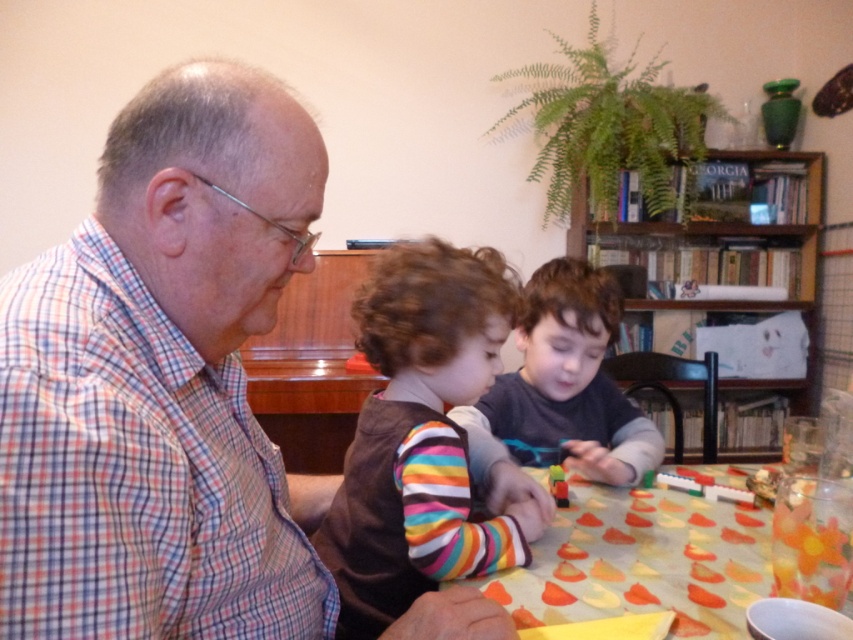
You are a photographer standing 10 feet away from the table. You want to take a photo of the brown fabric shirt at center and dark gray sweater at center so that both are clearly visible in the frame. Considering their distance apart, will you need to zoom in or zoom out to ensure both items are fully captured in the photo?

The brown fabric shirt at center and dark gray sweater at center are 8.49 inches apart. Since you are 10 feet away, this distance is small enough that you likely do not need to zoom in or zoom out excessively. A standard focal length should capture both items clearly without cropping either out. However, slight adjustments may depend on the camera sensor size and lens capabilities.

You are a parent observing the scene. The yellow paper at center is important for a craft project. The older man on the left needs to reach it without disturbing the children. Can he do so comfortably?

The older man on the left and the yellow paper at center are 27.87 inches apart. Since this distance is within a comfortable reach for most adults, he can likely extend his arm to grab the yellow paper at center without needing to move closer or disturb the children.